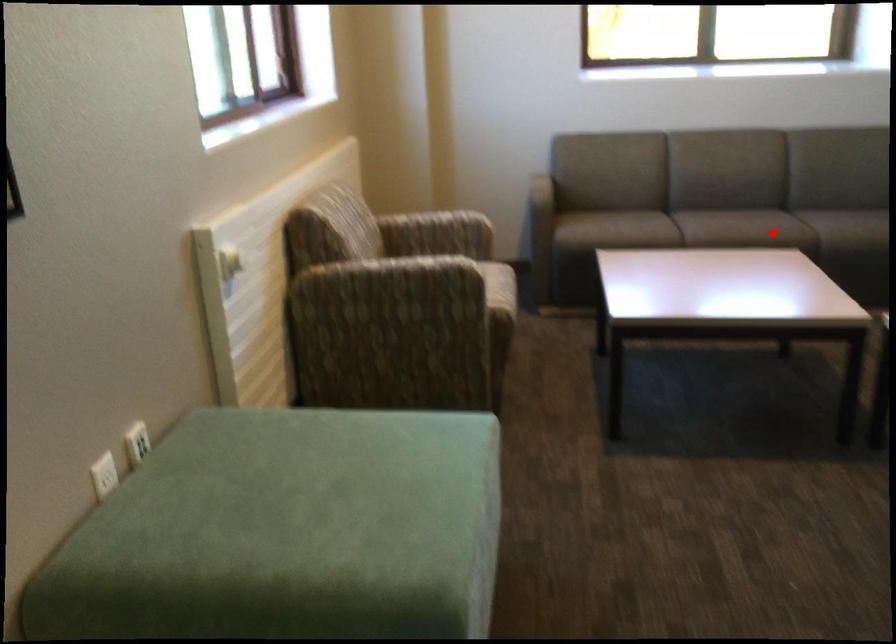
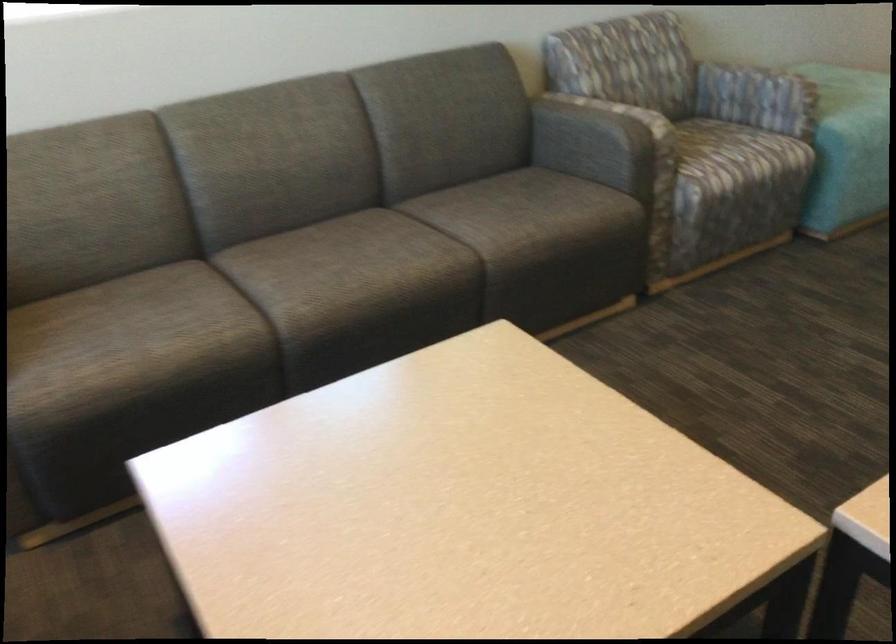
In the second image, find the point that corresponds to the highlighted location in the first image.

(427, 269)